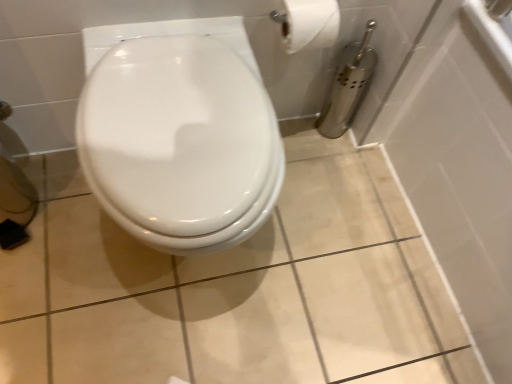
Locate an element on the screen. This screenshot has height=384, width=512. free space above white glossy toilet at center (from a real-world perspective) is located at coordinates (181, 114).